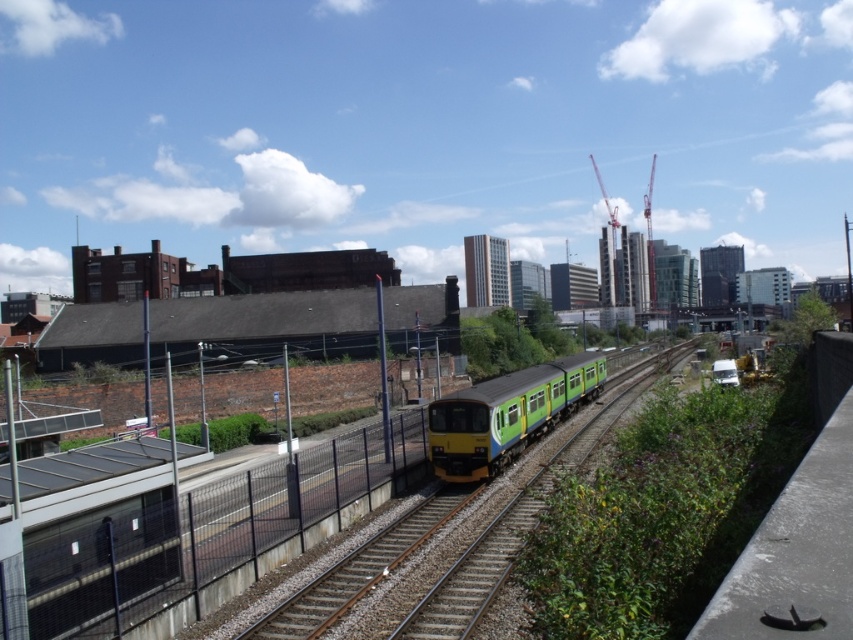
You are a maintenance worker checking the height clearance for a new overhead bridge being built over the railway tracks. You need to ensure that the bridge is tall enough to allow the green matte train at center to pass underneath without any obstruction. Given that the brown gravel train track at center is at ground level, can you determine if the bridge needs to be built higher than the track level?

The green matte train at center is taller than the brown gravel train track at center. Since the track is at ground level, the bridge must be built higher than the track level to accommodate the height of the train.

You are a passenger on the green matte train at center. You look down and see the brown gravel train track at center below you. Can you confirm if the train is currently on the tracks?

Yes, the green matte train at center is positioned over brown gravel train track at center, so the train is currently on the tracks.